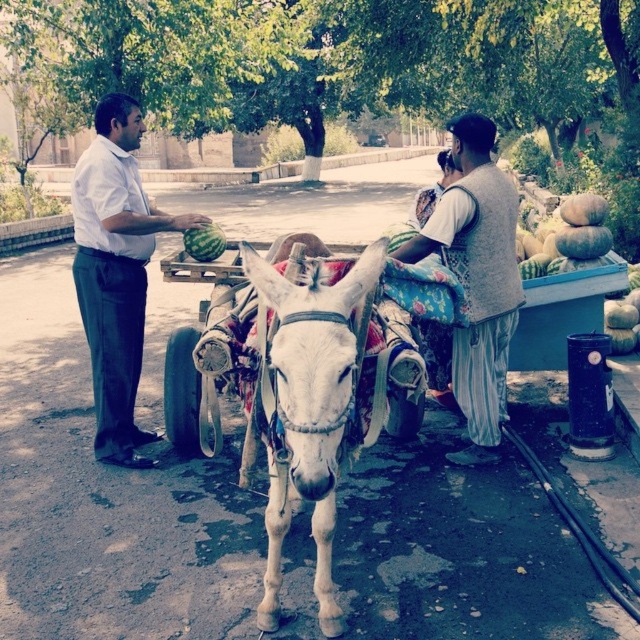
Question: Is white leather donkey at center to the left of white shirt at left from the viewer's perspective?

Choices:
 (A) no
 (B) yes

Answer: (A)

Question: Can you confirm if knitted beige vest at center is positioned to the right of green textured pumpkins at right?

Choices:
 (A) yes
 (B) no

Answer: (B)

Question: Among these points, which one is nearest to the camera?

Choices:
 (A) (93, 147)
 (B) (564, 241)

Answer: (A)

Question: Based on their relative distances, which object is farther from the green textured pumpkins at right?

Choices:
 (A) knitted beige vest at center
 (B) white leather wagon at center

Answer: (A)

Question: Which object is farther from the camera taking this photo?

Choices:
 (A) white shirt at left
 (B) knitted beige vest at center

Answer: (A)

Question: Is knitted beige vest at center to the left of green matte watermelon at center from the viewer's perspective?

Choices:
 (A) no
 (B) yes

Answer: (A)